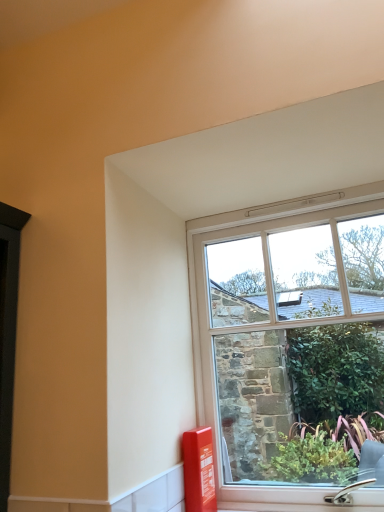
Measure the distance between matte red fire extinguisher at lower right and camera.

matte red fire extinguisher at lower right and camera are 1.27 meters apart.

Image resolution: width=384 pixels, height=512 pixels. What do you see at coordinates (199, 470) in the screenshot?
I see `matte red fire extinguisher at lower right` at bounding box center [199, 470].

Where is `matte red fire extinguisher at lower right`? The width and height of the screenshot is (384, 512). matte red fire extinguisher at lower right is located at coordinates (199, 470).

Describe the element at coordinates (292, 346) in the screenshot. The width and height of the screenshot is (384, 512). I see `clear glass window at center` at that location.

You are a GUI agent. You are given a task and a screenshot of the screen. Output one action in this format:
    pyautogui.click(x=<x>, y=<y>)
    Task: Click on the clear glass window at center
    The width and height of the screenshot is (384, 512).
    Given the screenshot: What is the action you would take?
    pyautogui.click(x=292, y=346)

This screenshot has height=512, width=384. Identify the location of matte red fire extinguisher at lower right. (199, 470).

Looking at this image, considering the positions of objects clear glass window at center and matte red fire extinguisher at lower right in the image provided, who is more to the left, clear glass window at center or matte red fire extinguisher at lower right?

matte red fire extinguisher at lower right is more to the left.

Is clear glass window at center in front of or behind matte red fire extinguisher at lower right in the image?

Visually, clear glass window at center is located in front of matte red fire extinguisher at lower right.

Considering the points (212, 334) and (206, 463), which point is in front, point (212, 334) or point (206, 463)?

The point (206, 463) is more forward.

From the image's perspective, is clear glass window at center beneath matte red fire extinguisher at lower right?

No.

From a real-world perspective, between clear glass window at center and matte red fire extinguisher at lower right, who is vertically lower?

From a 3D spatial view, matte red fire extinguisher at lower right is below.

Looking at this image, considering the relative sizes of clear glass window at center and matte red fire extinguisher at lower right in the image provided, is clear glass window at center thinner than matte red fire extinguisher at lower right?

Yes.

Between clear glass window at center and matte red fire extinguisher at lower right, which one has more height?

clear glass window at center.

Is clear glass window at center bigger or smaller than matte red fire extinguisher at lower right?

Clearly, clear glass window at center is larger in size than matte red fire extinguisher at lower right.

Which is correct: clear glass window at center is inside matte red fire extinguisher at lower right, or outside of it?

clear glass window at center lies outside matte red fire extinguisher at lower right.

In the scene shown: Is clear glass window at center touching matte red fire extinguisher at lower right?

clear glass window at center is not next to matte red fire extinguisher at lower right, and they're not touching.

Is clear glass window at center aimed at matte red fire extinguisher at lower right?

Yes, clear glass window at center faces towards matte red fire extinguisher at lower right.

Measure the distance from clear glass window at center to matte red fire extinguisher at lower right.

clear glass window at center and matte red fire extinguisher at lower right are 16.78 inches apart from each other.

Locate an element on the screen. The height and width of the screenshot is (512, 384). window box below the clear glass window at center (from a real-world perspective) is located at coordinates (199, 470).

Does matte red fire extinguisher at lower right appear on the left side of clear glass window at center?

Correct, you'll find matte red fire extinguisher at lower right to the left of clear glass window at center.

Consider the image. Does matte red fire extinguisher at lower right lie behind clear glass window at center?

Yes, matte red fire extinguisher at lower right is behind clear glass window at center.

Which is closer, (x=197, y=452) or (x=324, y=434)?

Clearly, point (x=197, y=452) is closer to the camera than point (x=324, y=434).

From the image's perspective, relative to clear glass window at center, is matte red fire extinguisher at lower right above or below?

matte red fire extinguisher at lower right is below clear glass window at center.

From a real-world perspective, is matte red fire extinguisher at lower right located higher than clear glass window at center?

No.

Considering the relative sizes of matte red fire extinguisher at lower right and clear glass window at center in the image provided, is matte red fire extinguisher at lower right thinner than clear glass window at center?

In fact, matte red fire extinguisher at lower right might be wider than clear glass window at center.

Considering the relative sizes of matte red fire extinguisher at lower right and clear glass window at center in the image provided, is matte red fire extinguisher at lower right taller than clear glass window at center?

In fact, matte red fire extinguisher at lower right may be shorter than clear glass window at center.

Can you confirm if matte red fire extinguisher at lower right is bigger than clear glass window at center?

No, matte red fire extinguisher at lower right is not bigger than clear glass window at center.

Is clear glass window at center a part of matte red fire extinguisher at lower right?

Definitely not — clear glass window at center is not inside matte red fire extinguisher at lower right.

Is matte red fire extinguisher at lower right in contact with clear glass window at center?

No.

Is matte red fire extinguisher at lower right oriented away from clear glass window at center?

Yes, matte red fire extinguisher at lower right is facing away from clear glass window at center.

What's the angular difference between matte red fire extinguisher at lower right and clear glass window at center's facing directions?

0.00448 degrees.

Measure the distance from matte red fire extinguisher at lower right to clear glass window at center.

matte red fire extinguisher at lower right and clear glass window at center are 16.78 inches apart from each other.

This screenshot has height=512, width=384. Identify the location of window to the right of matte red fire extinguisher at lower right. (292, 346).

Locate an element on the screen. window that appears above the matte red fire extinguisher at lower right (from a real-world perspective) is located at coordinates (292, 346).

Find the location of a particular element. This screenshot has height=512, width=384. window on the right side of matte red fire extinguisher at lower right is located at coordinates (292, 346).